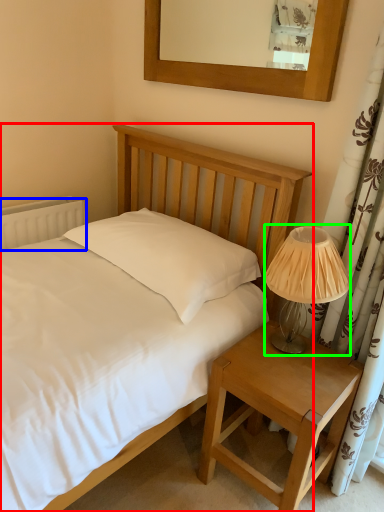
Question: Which object is positioned closest to bed (highlighted by a red box)? Select from radiator (highlighted by a blue box) and table lamp (highlighted by a green box).

Choices:
 (A) radiator
 (B) table lamp

Answer: (B)